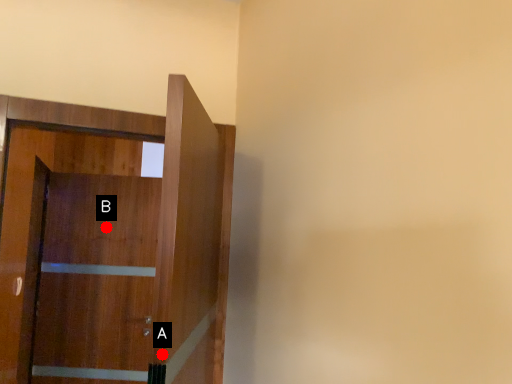
Question: Two points are circled on the image, labeled by A and B beside each circle. Which of the following is the closest to the observer?

Choices:
 (A) A is closer
 (B) B is closer

Answer: (A)